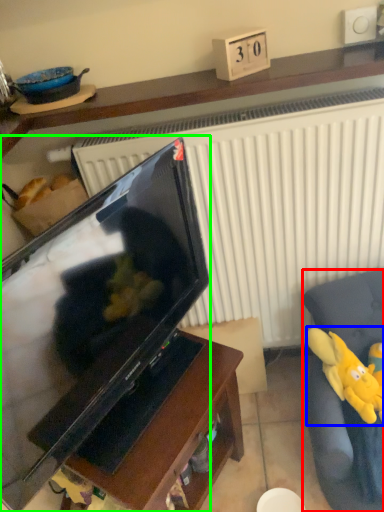
Question: Based on their relative distances, which object is farther from furniture (highlighted by a red box)? Choose from toy (highlighted by a blue box) and television (highlighted by a green box).

Choices:
 (A) toy
 (B) television

Answer: (B)